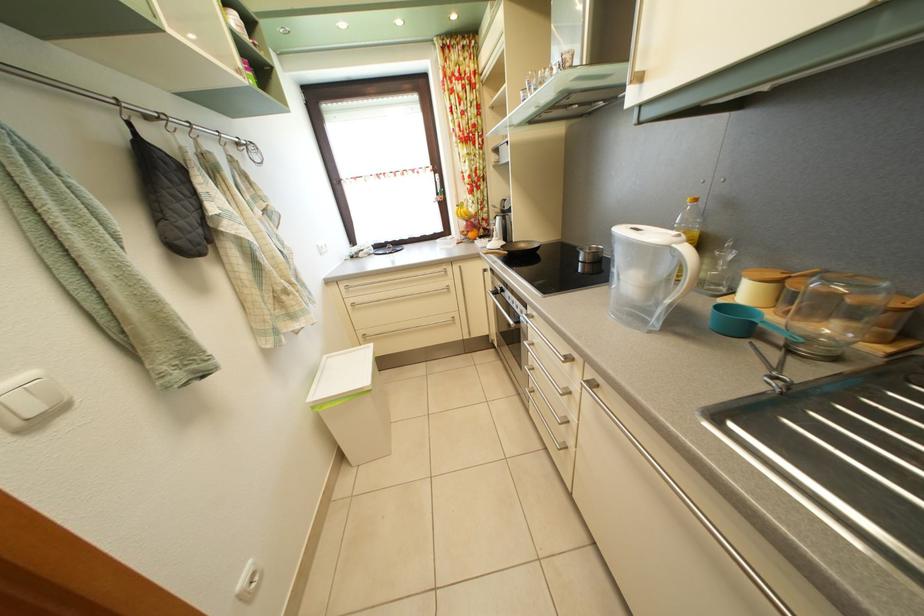
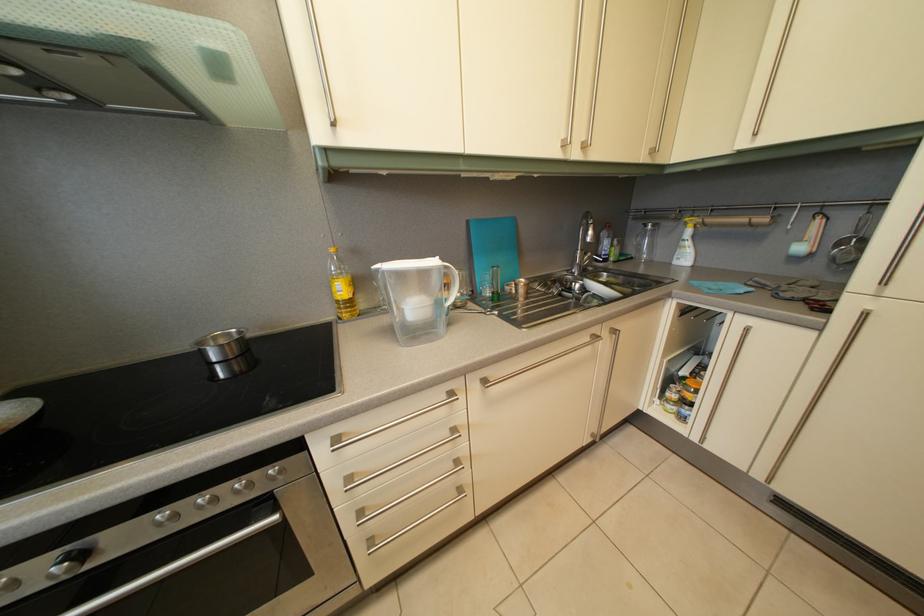
How did the camera likely rotate?

The camera rotated toward right-down.